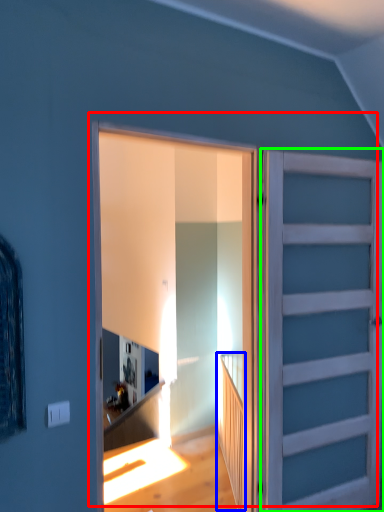
Question: Considering the real-world distances, which object is farthest from door (highlighted by a red box)? stairwell (highlighted by a blue box) or door (highlighted by a green box)?

Choices:
 (A) stairwell
 (B) door

Answer: (A)